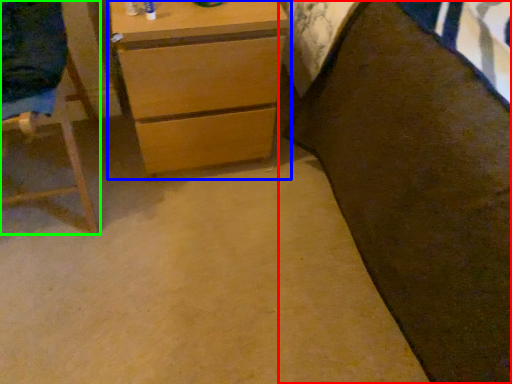
Question: Which object is the closest to the bed (highlighted by a red box)? Choose among these: chest of drawers (highlighted by a blue box) or furniture (highlighted by a green box).

Choices:
 (A) chest of drawers
 (B) furniture

Answer: (A)